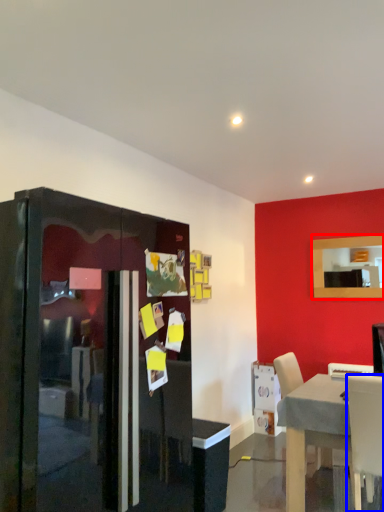
Question: Which object is further to the camera taking this photo, mirror (highlighted by a red box) or chair (highlighted by a blue box)?

Choices:
 (A) mirror
 (B) chair

Answer: (A)